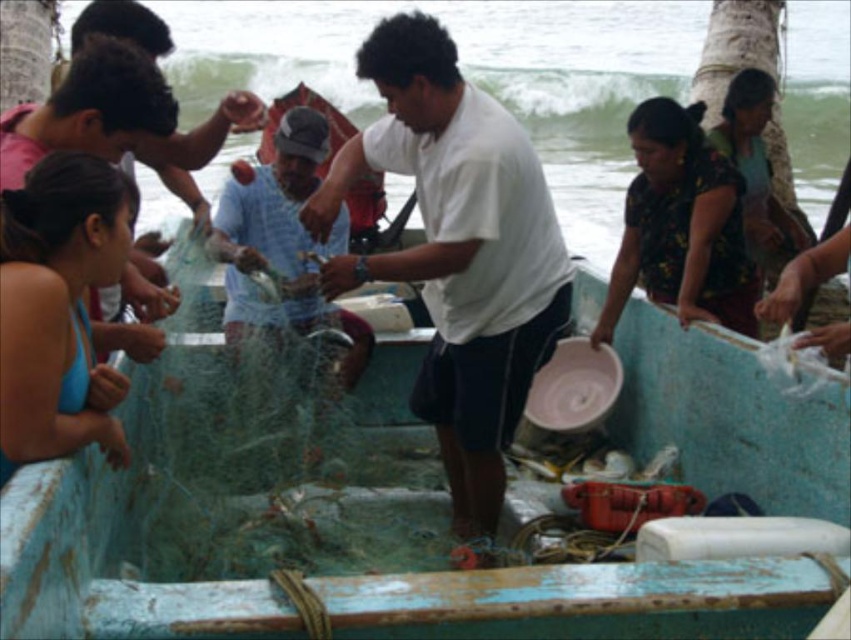
You are standing on the shore and see the blue painted wood boat at center and the white matte shirt at center. Which object is closer to you?

The blue painted wood boat at center is closer to you because it is in front of the white matte shirt at center.

You are a photographer on the boat and want to capture a clear photo of the white matte shirt at center and the translucent plastic net at center. Which object will appear larger in the photo?

The white matte shirt at center will appear larger in the photo because it is taller than the translucent plastic net at center.

You are standing on the boat and want to move from point (649, 360) to point (503, 124). Will you be moving towards the boat or away from it?

Moving from point (649, 360) to point (503, 124) means you are moving away from the boat because point (503, 124) is closer to the shore than point (649, 360).